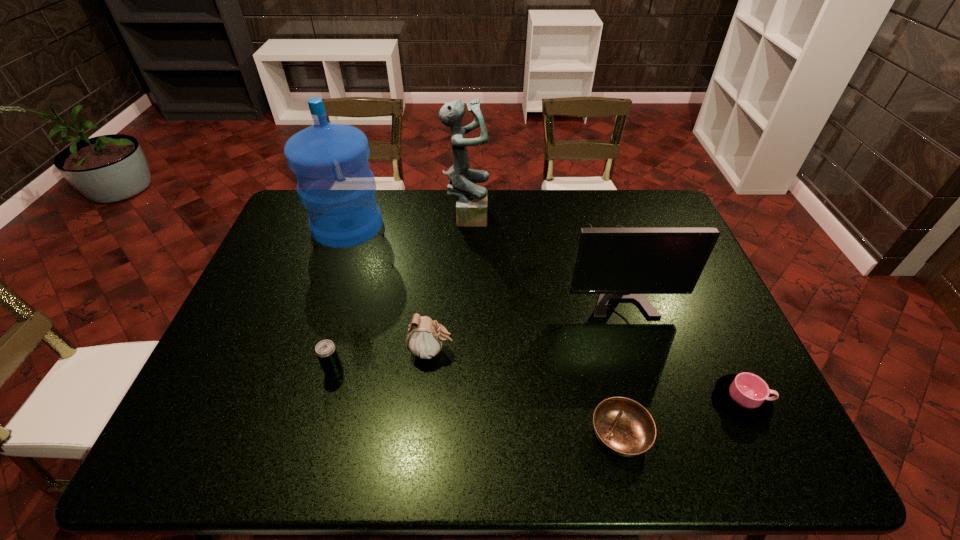
Where is `water jug`? water jug is located at coordinates (335, 184).

In order to click on sculpture in this screenshot , I will do `click(471, 205)`.

Find the location of `computer monitor`. computer monitor is located at coordinates (621, 263).

Identify the location of pouch. (424, 339).

The image size is (960, 540). What are the coordinates of `beer can` in the screenshot? It's located at (326, 352).

The image size is (960, 540). Identify the location of cup. (745, 396).

In order to click on soup bowl in this screenshot , I will do `click(624, 427)`.

This screenshot has height=540, width=960. I want to click on blank area located 0.230m on the right of the water jug, so click(x=450, y=226).

Image resolution: width=960 pixels, height=540 pixels. In order to click on vacant space located on the face of the sculpture in this screenshot , I will do `click(549, 215)`.

Find the location of a particular element. vacant region located on the screen side of the fifth shortest object is located at coordinates (642, 368).